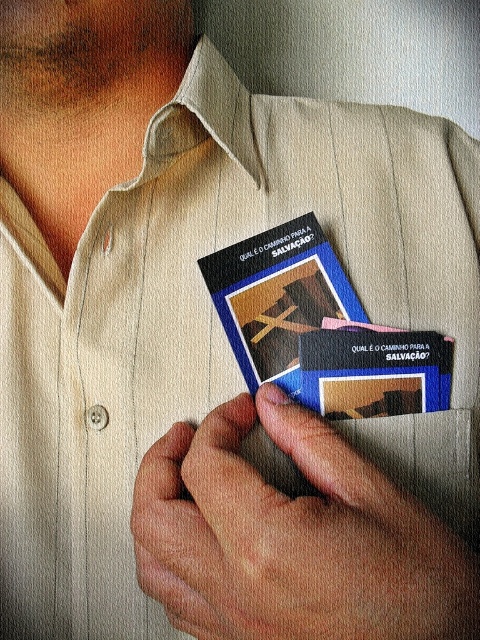
Question: Does smooth skin hand at center appear under blue cardboard business card at center?

Choices:
 (A) yes
 (B) no

Answer: (A)

Question: Which point is closer to the camera?

Choices:
 (A) smooth skin hand at center
 (B) blue glossy book at center
 (C) blue cardboard business card at center

Answer: (A)

Question: Is smooth skin hand at center wider than blue cardboard business card at center?

Choices:
 (A) yes
 (B) no

Answer: (A)

Question: Can you confirm if blue glossy book at center is positioned to the right of blue cardboard business card at center?

Choices:
 (A) yes
 (B) no

Answer: (B)

Question: Which of the following is the closest to the observer?

Choices:
 (A) (249, 278)
 (B) (267, 554)
 (C) (305, 332)

Answer: (B)

Question: Which is farther from the blue cardboard business card at center?

Choices:
 (A) blue glossy book at center
 (B) smooth skin hand at center

Answer: (B)